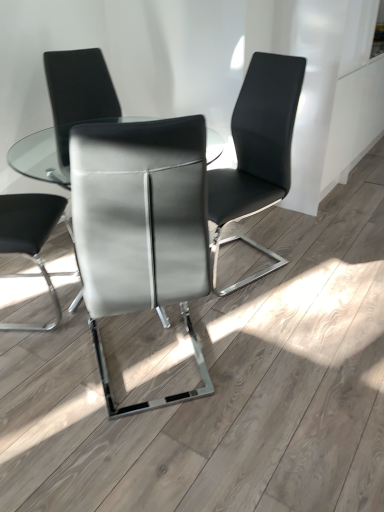
At what (x,y) coordinates should I click in order to perform the action: click on free space in front of matte black chair at center, marked as the 1th chair in a right-to-left arrangement. Please return your answer as a coordinate pair (x, y). Looking at the image, I should click on (265, 315).